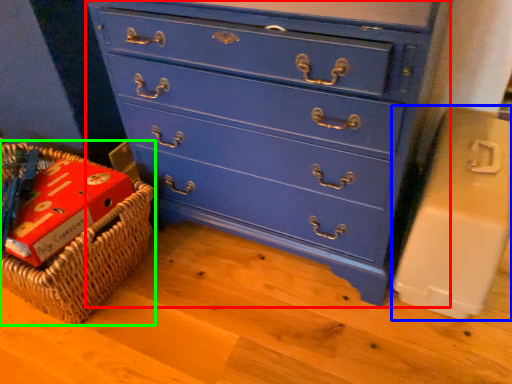
Question: Estimate the real-world distances between objects in this image. Which object is farther from chest of drawers (highlighted by a red box), cardboard box (highlighted by a blue box) or basket (highlighted by a green box)?

Choices:
 (A) cardboard box
 (B) basket

Answer: (B)